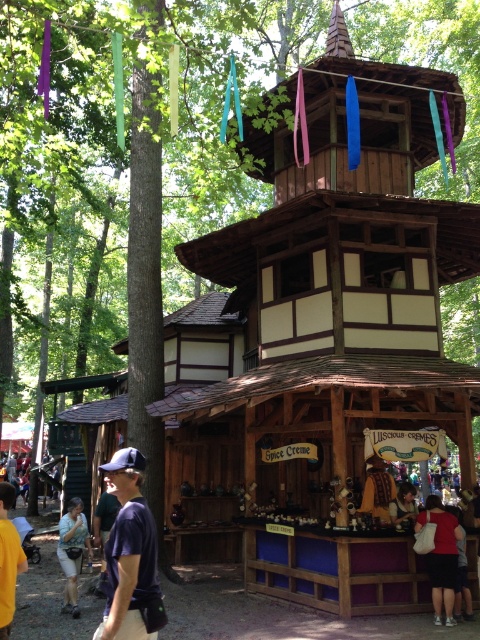
Is point (131, 513) less distant than point (395, 506)?

Yes, it is.

At what (x,y) coordinates should I click in order to perform the action: click on dark blue fabric cap at lower left. Please return your answer as a coordinate pair (x, y). This screenshot has height=640, width=480. Looking at the image, I should click on (129, 552).

This screenshot has width=480, height=640. Describe the element at coordinates (129, 552) in the screenshot. I see `dark blue fabric cap at lower left` at that location.

This screenshot has height=640, width=480. Identify the location of dark blue fabric cap at lower left. (129, 552).

From the picture: Between dark blue t-shirt at lower left and light blue denim shorts at lower left, which one is positioned higher?

dark blue t-shirt at lower left is higher up.

In the scene shown: Can you confirm if dark blue t-shirt at lower left is positioned to the right of light blue denim shorts at lower left?

Yes, dark blue t-shirt at lower left is to the right of light blue denim shorts at lower left.

Who is more forward, (x=22, y=566) or (x=59, y=525)?

Point (x=22, y=566) is in front.

At what (x,y) coordinates should I click in order to perform the action: click on dark blue t-shirt at lower left. Please return your answer as a coordinate pair (x, y). The width and height of the screenshot is (480, 640). Looking at the image, I should click on (8, 560).

Does point (109, 536) come closer to viewer compared to point (64, 557)?

Yes, point (109, 536) is closer to viewer.

Measure the distance between dark blue fabric cap at lower left and light blue denim shorts at lower left.

The distance of dark blue fabric cap at lower left from light blue denim shorts at lower left is 5.22 meters.

Between point (147, 556) and point (58, 552), which one is positioned in front?

Point (147, 556) is more forward.

Find the location of `dark blue fabric cap at lower left`. dark blue fabric cap at lower left is located at coordinates (129, 552).